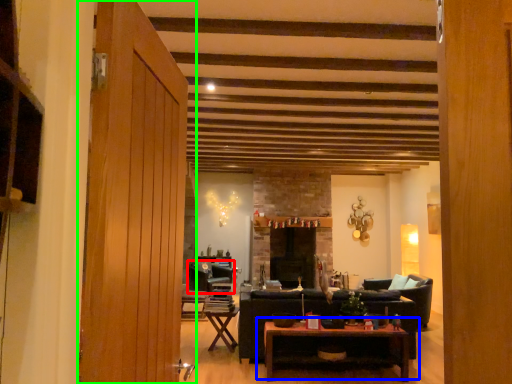
Question: Based on their relative distances, which object is nearer to chair (highlighted by a red box)? Choose from coffee table (highlighted by a blue box) and door (highlighted by a green box).

Choices:
 (A) coffee table
 (B) door

Answer: (A)